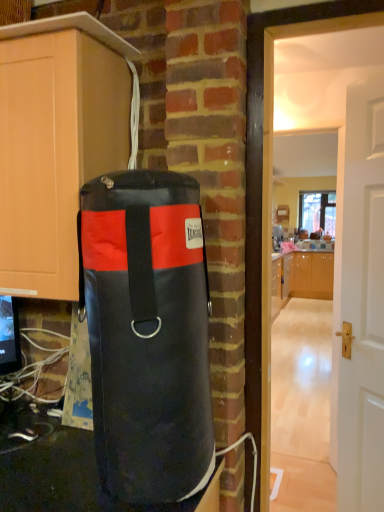
Question: Is white glossy door at center right at the back of glossy wood cabinets at center, arranged as the 2th cabinetry when viewed from the front?

Choices:
 (A) no
 (B) yes

Answer: (A)

Question: Considering the relative sizes of glossy wood cabinets at center, placed as the second cabinetry when sorted from left to right, and white glossy door at center right in the image provided, is glossy wood cabinets at center, placed as the second cabinetry when sorted from left to right, smaller than white glossy door at center right?

Choices:
 (A) no
 (B) yes

Answer: (A)

Question: Is glossy wood cabinets at center, the first cabinetry in the right-to-left sequence, closer to camera compared to white glossy door at center right?

Choices:
 (A) no
 (B) yes

Answer: (A)

Question: Does glossy wood cabinets at center, arranged as the 2th cabinetry when viewed from the front, appear on the left side of white glossy door at center right?

Choices:
 (A) no
 (B) yes

Answer: (A)

Question: Is glossy wood cabinets at center, arranged as the 2th cabinetry when viewed from the front, far from white glossy door at center right?

Choices:
 (A) yes
 (B) no

Answer: (A)

Question: Considering the positions of black leather punching bag at left and white glossy door at center right in the image, is black leather punching bag at left wider or thinner than white glossy door at center right?

Choices:
 (A) wide
 (B) thin

Answer: (A)

Question: From the image's perspective, is black leather punching bag at left above or below white glossy door at center right?

Choices:
 (A) above
 (B) below

Answer: (A)

Question: Considering the positions of point (198, 251) and point (382, 426), is point (198, 251) closer or farther from the camera than point (382, 426)?

Choices:
 (A) farther
 (B) closer

Answer: (B)

Question: Choose the correct answer: Is black leather punching bag at left inside white glossy door at center right or outside it?

Choices:
 (A) outside
 (B) inside

Answer: (A)

Question: From a real-world perspective, is glossy wood cabinets at center, arranged as the 2th cabinetry when viewed from the front, above or below black leather punching bag at left?

Choices:
 (A) above
 (B) below

Answer: (B)

Question: Considering the relative positions of glossy wood cabinets at center, placed as the second cabinetry when sorted from left to right, and black leather punching bag at left in the image provided, is glossy wood cabinets at center, placed as the second cabinetry when sorted from left to right, to the left or to the right of black leather punching bag at left?

Choices:
 (A) left
 (B) right

Answer: (B)

Question: Does point (322, 275) appear closer or farther from the camera than point (173, 297)?

Choices:
 (A) farther
 (B) closer

Answer: (A)

Question: From their relative heights in the image, would you say glossy wood cabinets at center, placed as the second cabinetry when sorted from left to right, is taller or shorter than black leather punching bag at left?

Choices:
 (A) short
 (B) tall

Answer: (B)

Question: In the image, is black leather punching bag at left on the left side or the right side of matte wood cabinet at left, the 2th cabinetry when ordered from back to front?

Choices:
 (A) left
 (B) right

Answer: (B)

Question: From the image's perspective, is black leather punching bag at left positioned above or below matte wood cabinet at left, acting as the 1th cabinetry starting from the left?

Choices:
 (A) below
 (B) above

Answer: (A)